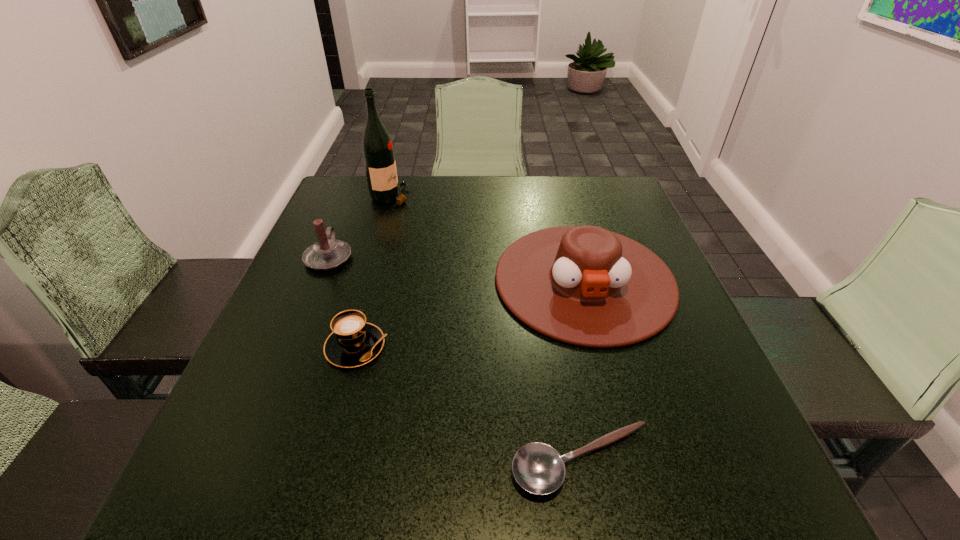
In order to click on blank space located on the side of the candle with the handle loop in this screenshot , I will do `click(356, 192)`.

Where is `vacant region located on the front-facing side of the cowboy hat`? vacant region located on the front-facing side of the cowboy hat is located at coordinates (615, 395).

In order to click on free space located on the front of the fourth tallest object in this screenshot , I will do `click(313, 504)`.

The height and width of the screenshot is (540, 960). I want to click on free spot located 0.080m on the back of the ladle, so click(568, 384).

Locate an element on the screen. The height and width of the screenshot is (540, 960). object that is positioned at the far edge is located at coordinates (377, 147).

I want to click on object positioned at the near edge, so click(x=538, y=468).

You are a GUI agent. You are given a task and a screenshot of the screen. Output one action in this format:
    pyautogui.click(x=<x>, y=<y>)
    Task: Click on the wine bottle that is at the left edge
    
    Given the screenshot: What is the action you would take?
    pyautogui.click(x=377, y=147)

Identify the location of candle at the left edge. (328, 253).

Where is `cappuccino located at the left edge`? The height and width of the screenshot is (540, 960). cappuccino located at the left edge is located at coordinates (354, 342).

Locate an element on the screen. cowboy hat that is at the right edge is located at coordinates (584, 285).